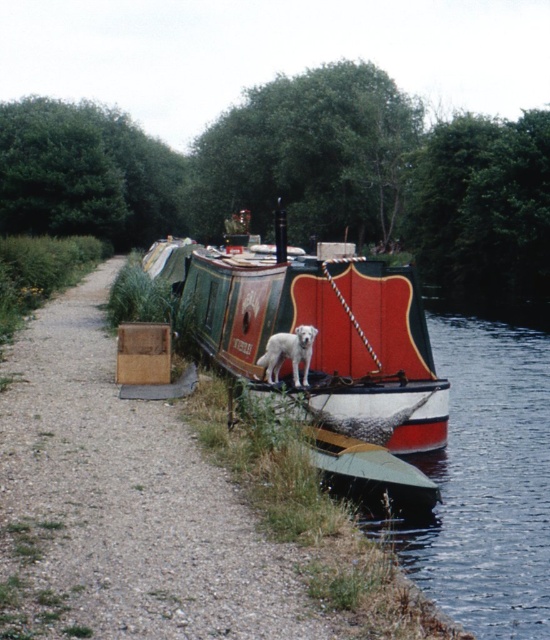
This screenshot has width=550, height=640. In order to click on polished wood barge at center in this screenshot , I will do `click(316, 328)`.

Does polished wood barge at center have a smaller size compared to white fur dog at center?

No, polished wood barge at center is not smaller than white fur dog at center.

Is point (190, 272) closer to viewer compared to point (306, 336)?

No, (190, 272) is further to viewer.

I want to click on polished wood barge at center, so click(316, 328).